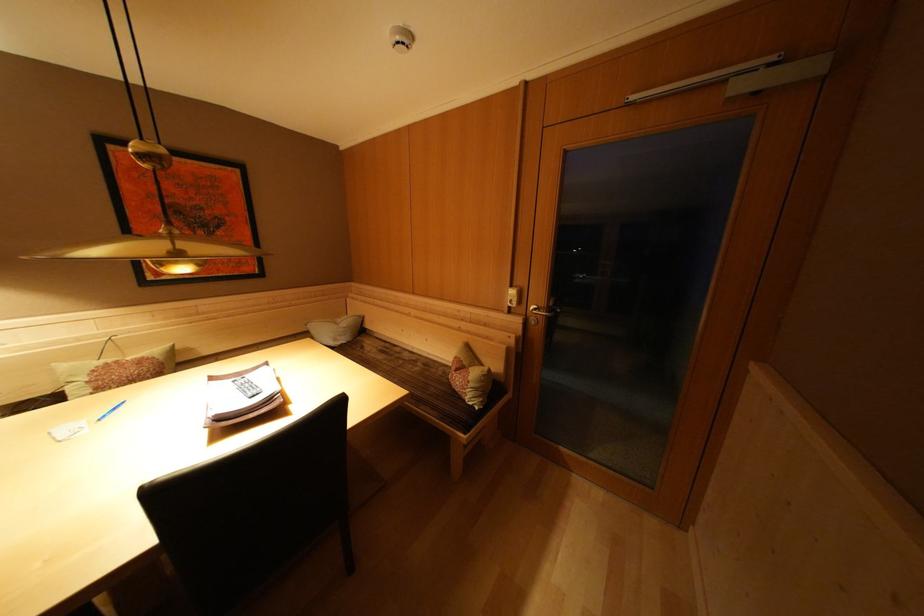
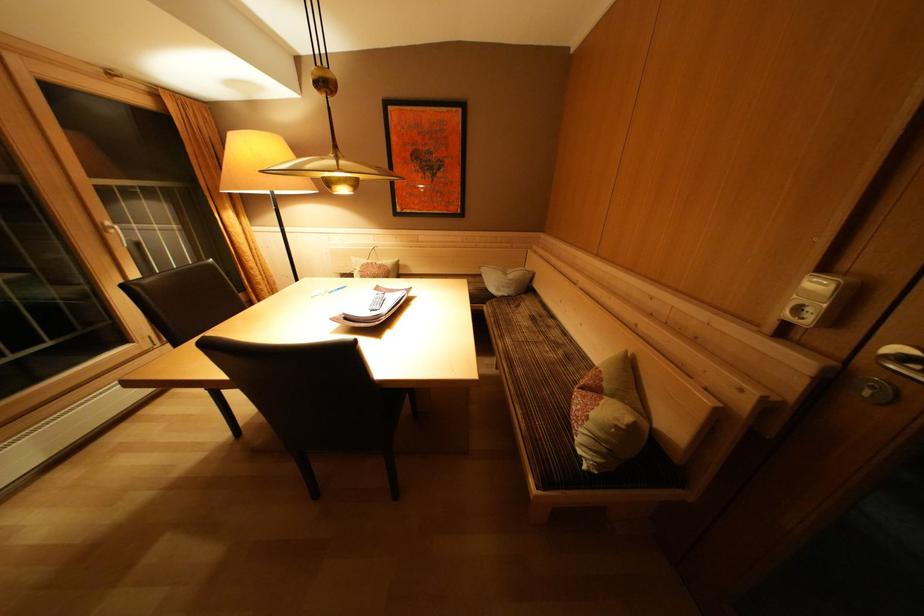
In the second image, find the point that corresponds to the point at 477,383 in the first image.

(600, 419)